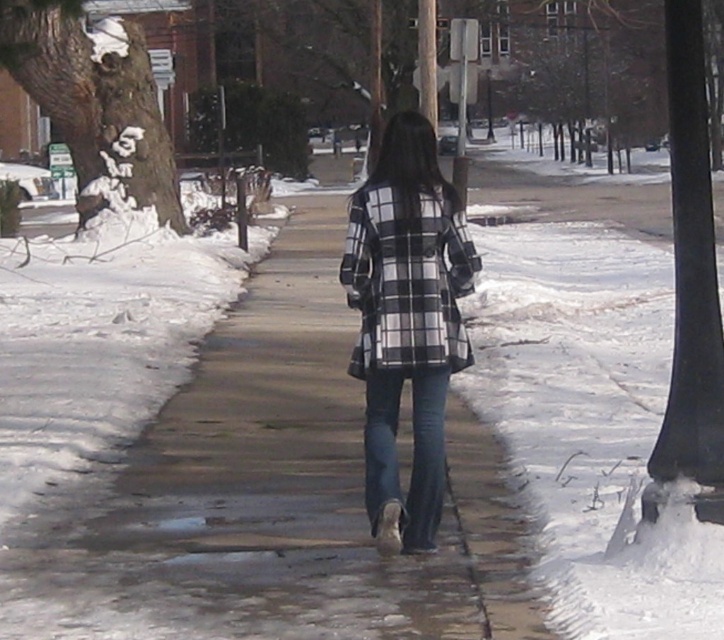
You are a fashion designer observing the winter scene. You notice the plaid fabric coat at center and the blue denim jeans at center. How far apart are these two items in inches?

The plaid fabric coat at center and blue denim jeans at center are 5.46 inches apart from each other.

You are standing on the sidewalk and see the black checkered coat at center and the black smooth pole at right. Which object is positioned farther to the right?

The black smooth pole at right is positioned farther to the right than the black checkered coat at center.

You are standing at the origin point of the image. The plaid fabric coat at center is located at point (x=405, y=323). If you want to walk directly towards the plaid fabric coat at center, which direction should you move in terms of the coordinate system?

To move towards the plaid fabric coat at center located at point (x=405, y=323) from the origin, you should move in the direction of increasing x and y coordinates since the point has positive coordinates in both axes.